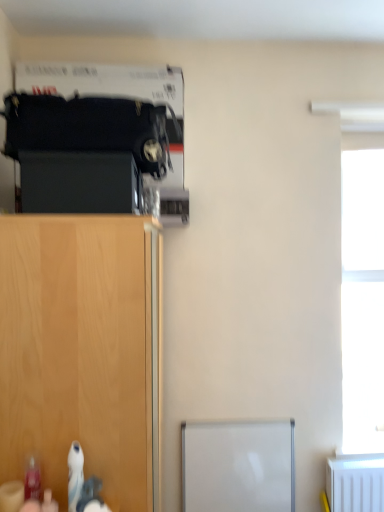
Question: Is black matte cabinet at left bigger than transparent glass window at right?

Choices:
 (A) no
 (B) yes

Answer: (A)

Question: Is black matte cabinet at left to the right of transparent glass window at right from the viewer's perspective?

Choices:
 (A) no
 (B) yes

Answer: (A)

Question: Is black matte cabinet at left located outside transparent glass window at right?

Choices:
 (A) yes
 (B) no

Answer: (A)

Question: From a real-world perspective, is black matte cabinet at left located beneath transparent glass window at right?

Choices:
 (A) no
 (B) yes

Answer: (A)

Question: From the image's perspective, is black matte cabinet at left below transparent glass window at right?

Choices:
 (A) no
 (B) yes

Answer: (A)

Question: Is transparent glass window at right at the back of black matte cabinet at left?

Choices:
 (A) no
 (B) yes

Answer: (A)

Question: Does transparent glass window at right appear on the left side of wooden cabinet at lower left?

Choices:
 (A) yes
 (B) no

Answer: (B)

Question: From a real-world perspective, is transparent glass window at right under wooden cabinet at lower left?

Choices:
 (A) yes
 (B) no

Answer: (B)

Question: Considering the relative sizes of transparent glass window at right and wooden cabinet at lower left in the image provided, is transparent glass window at right bigger than wooden cabinet at lower left?

Choices:
 (A) no
 (B) yes

Answer: (A)

Question: Is transparent glass window at right not within wooden cabinet at lower left?

Choices:
 (A) no
 (B) yes

Answer: (B)

Question: Is transparent glass window at right next to wooden cabinet at lower left?

Choices:
 (A) yes
 (B) no

Answer: (B)

Question: From the image's perspective, is transparent glass window at right located above wooden cabinet at lower left?

Choices:
 (A) yes
 (B) no

Answer: (A)

Question: Is wooden cabinet at lower left closer to the viewer compared to black matte cabinet at left?

Choices:
 (A) yes
 (B) no

Answer: (A)